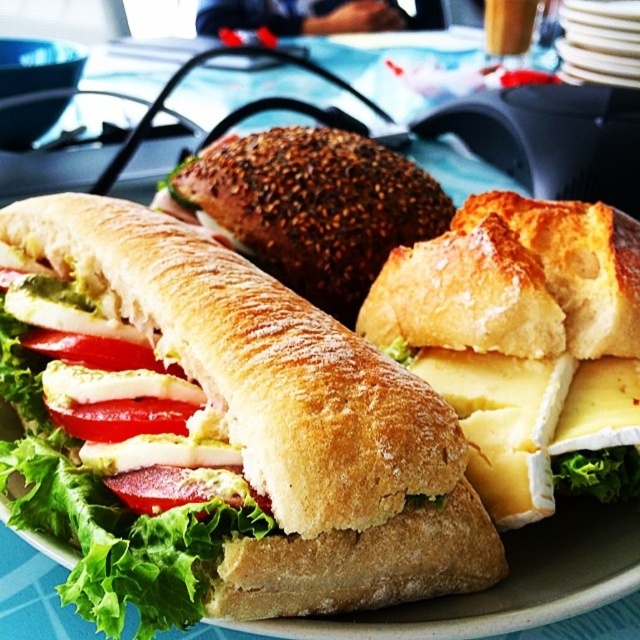
Is the position of white ceramic plate at upper right less distant than that of red glossy tomato at center?

No, it is not.

This screenshot has width=640, height=640. Describe the element at coordinates (600, 42) in the screenshot. I see `white ceramic plate at upper right` at that location.

Where is `white ceramic plate at upper right`? Image resolution: width=640 pixels, height=640 pixels. white ceramic plate at upper right is located at coordinates (600, 42).

Is point (275, 449) farther from viewer compared to point (163, 502)?

No, it is not.

The width and height of the screenshot is (640, 640). What are the coordinates of `breadsoftsandwich at center` in the screenshot? It's located at (228, 422).

Is sesame seed bun at center closer to camera compared to white ceramic plate at upper right?

Yes.

Does sesame seed bun at center appear on the left side of white ceramic plate at upper right?

Correct, you'll find sesame seed bun at center to the left of white ceramic plate at upper right.

The height and width of the screenshot is (640, 640). I want to click on sesame seed bun at center, so click(314, 208).

Image resolution: width=640 pixels, height=640 pixels. Identify the location of sesame seed bun at center. (314, 208).